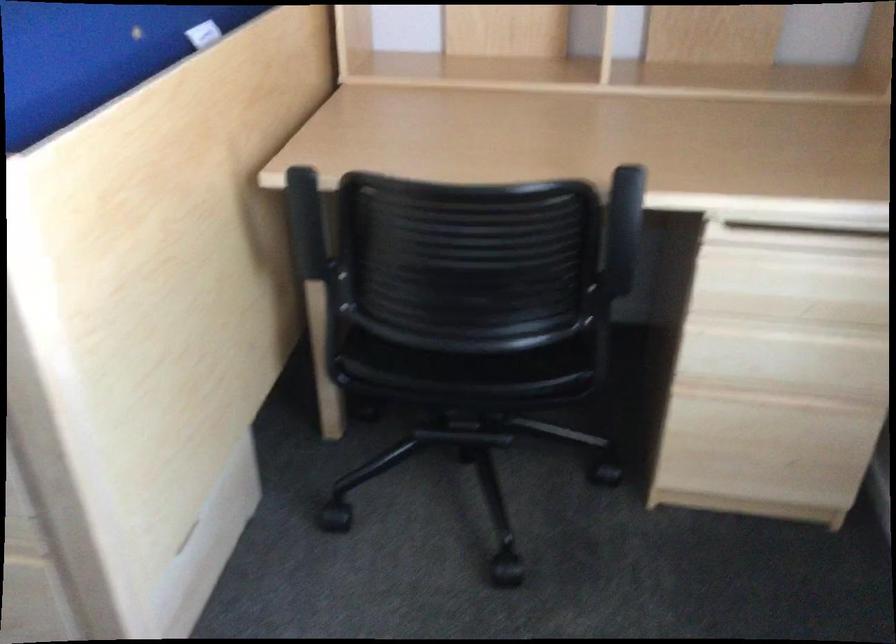
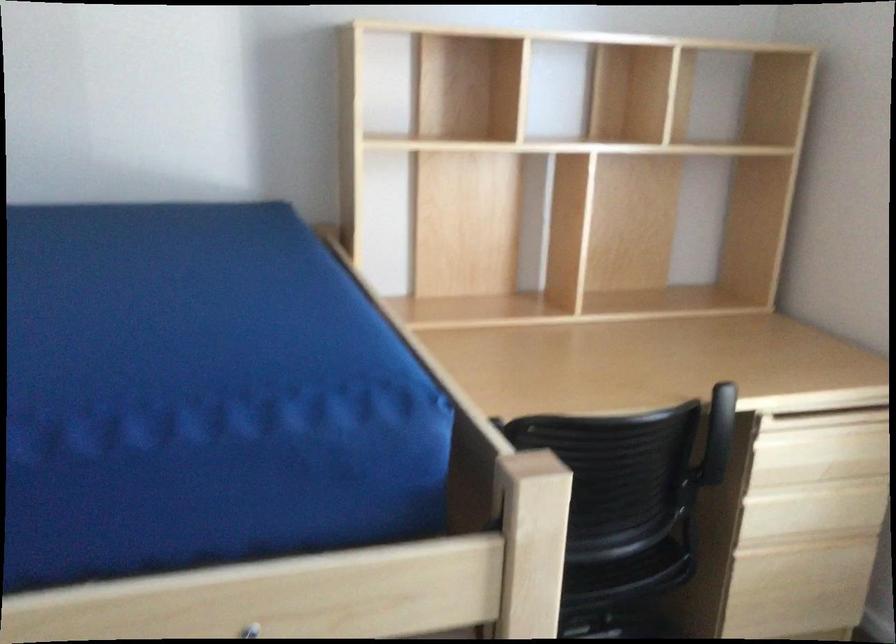
Where in the second image is the point corresponding to [798,283] from the first image?

(819, 450)